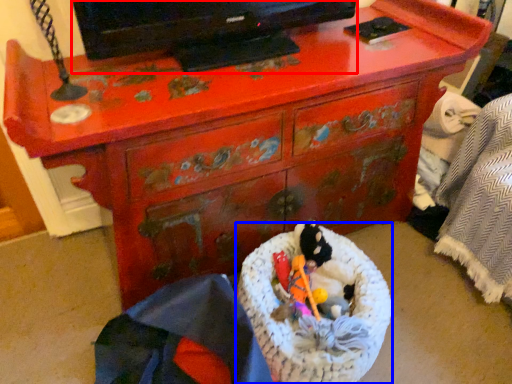
Question: Which of the following is the farthest to the observer, television (highlighted by a red box) or laundry basket (highlighted by a blue box)?

Choices:
 (A) television
 (B) laundry basket

Answer: (B)